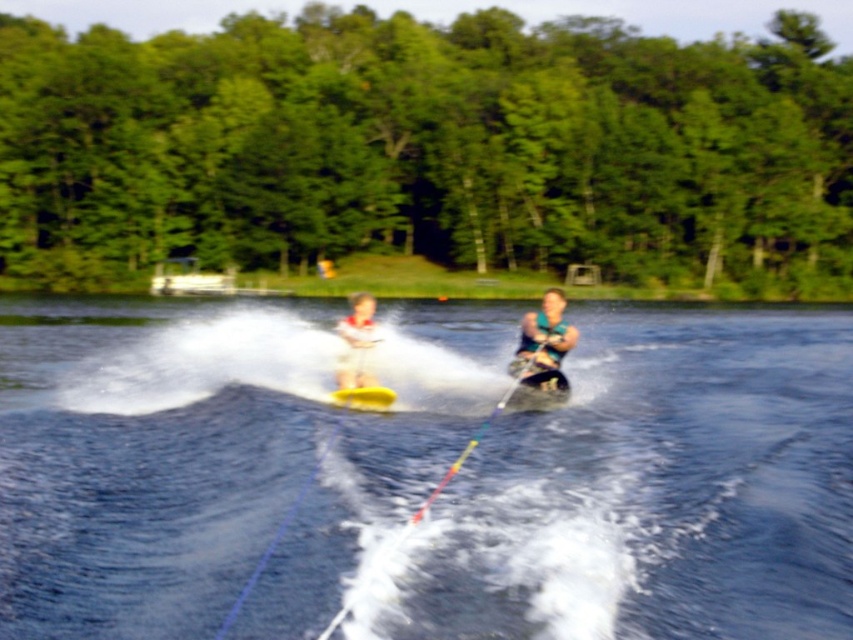
You are a photographer trying to capture the boat and the trees in the background. According to the scene, which object is positioned to the right when focusing on the green leafy trees at upper center and white plastic boat at upper center?

The green leafy trees at upper center are to the right of the white plastic boat at upper center.

You are a lifeguard observing two skiers wearing life vests. The scene shows a matte green life vest at center and a white matte life vest at center. Which life vest is bigger?

The matte green life vest at center is larger in size than the white matte life vest at center.